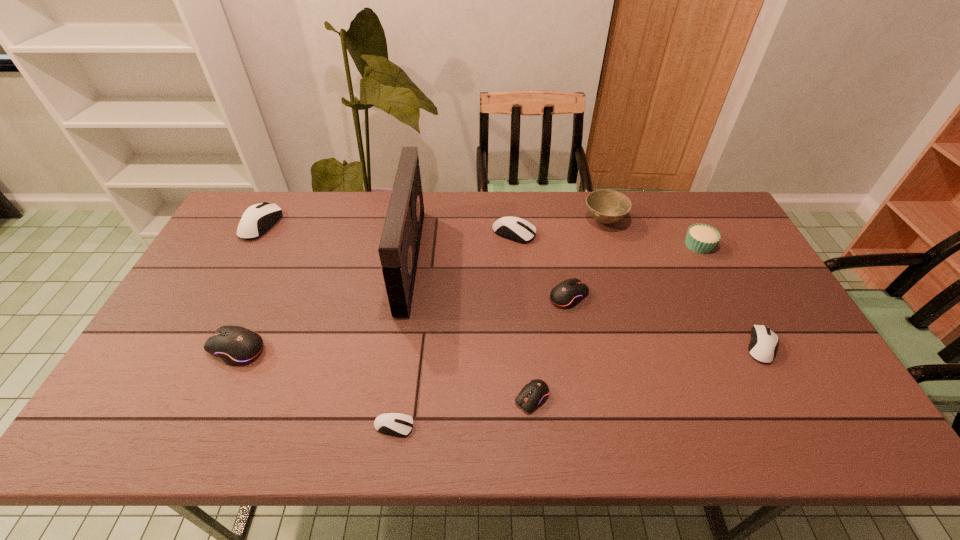
Locate an element on the screen. The height and width of the screenshot is (540, 960). the closest white mouse relative to the eighth object from left to right is located at coordinates (520, 230).

Identify which white mouse is the fourth closest to the second farthest black computer mouse. Please provide its 2D coordinates. Your answer should be formatted as a tuple, i.e. [(x, y)], where the tuple contains the x and y coordinates of a point satisfying the conditions above.

[(763, 344)]

Locate which black computer mouse is the second closest to the second black computer mouse from left to right. Please provide its 2D coordinates. Your answer should be formatted as a tuple, i.e. [(x, y)], where the tuple contains the x and y coordinates of a point satisfying the conditions above.

[(235, 345)]

The width and height of the screenshot is (960, 540). In order to click on black computer mouse that can be found as the closest to the nearest object in this screenshot , I will do `click(535, 393)`.

Locate an element on the screen. blank space that satisfies the following two spatial constraints: 1. on the back side of the nearest black computer mouse; 2. on the left side of the second smallest black computer mouse is located at coordinates (522, 295).

Find the location of a particular element. The height and width of the screenshot is (540, 960). vacant space that satisfies the following two spatial constraints: 1. on the front side of the cupcake; 2. on the right side of the rightmost white mouse is located at coordinates (751, 346).

What are the coordinates of `free point that satisfies the following two spatial constraints: 1. on the front side of the second farthest black computer mouse; 2. on the left side of the shortest object` in the screenshot? It's located at (202, 426).

You are a GUI agent. You are given a task and a screenshot of the screen. Output one action in this format:
    pyautogui.click(x=<x>, y=<y>)
    Task: Click on the free space that satisfies the following two spatial constraints: 1. on the back side of the cupcake; 2. on the right side of the third farthest mouse
    
    Given the screenshot: What is the action you would take?
    pyautogui.click(x=560, y=245)